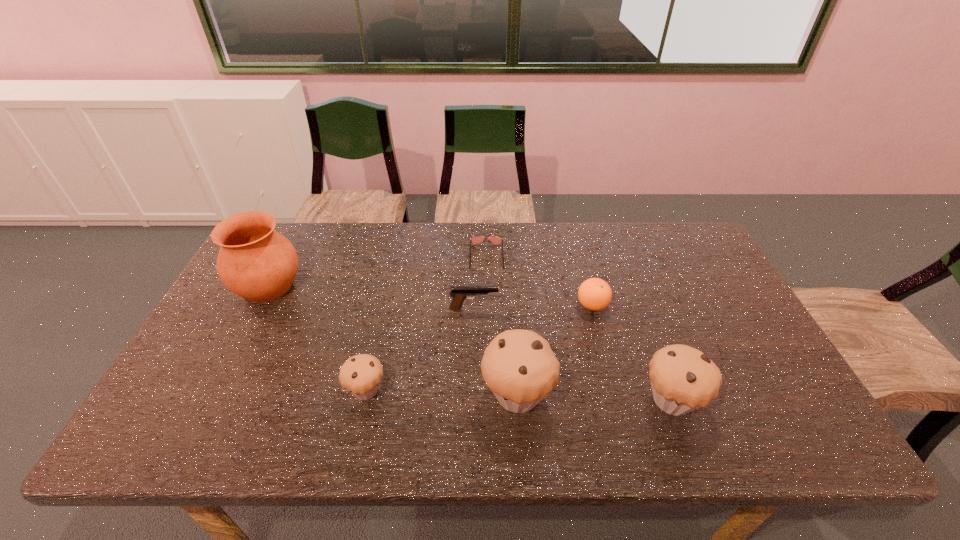
Please point a free position for a muffin on the left. Please provide its 2D coordinates. Your answer should be formatted as a tuple, i.e. [(x, y)], where the tuple contains the x and y coordinates of a point satisfying the conditions above.

[(217, 385)]